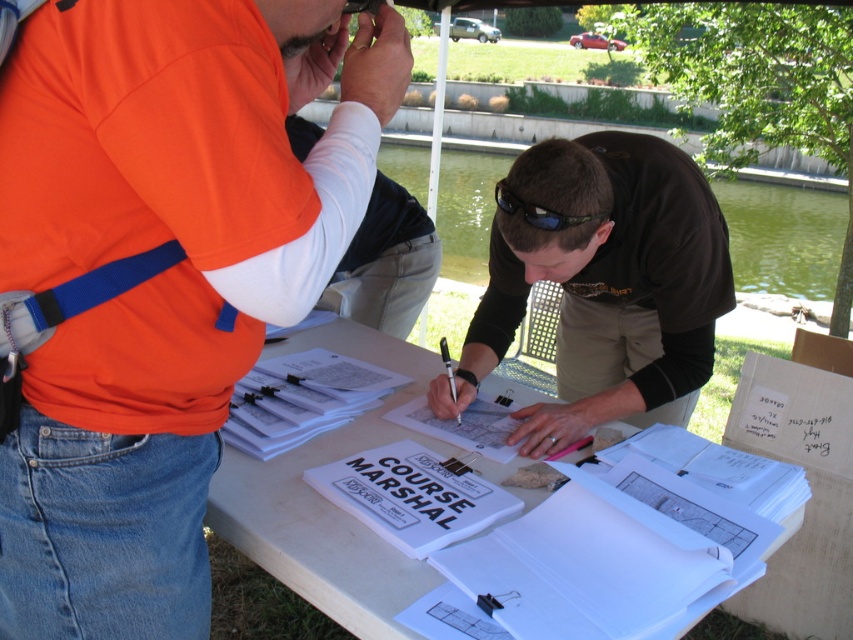
Question: Does orange fabric shirt at left come in front of black plastic sunglasses at center?

Choices:
 (A) no
 (B) yes

Answer: (B)

Question: Is orange fabric shirt at left bigger than white paper at center?

Choices:
 (A) yes
 (B) no

Answer: (B)

Question: Among these points, which one is farthest from the camera?

Choices:
 (A) (614, 241)
 (B) (221, 472)
 (C) (26, 513)
 (D) (608, 211)

Answer: (A)

Question: Based on their relative distances, which object is farther from the white paper at center?

Choices:
 (A) black matte shirt at center
 (B) black plastic sunglasses at center

Answer: (B)

Question: Among these objects, which one is farthest from the camera?

Choices:
 (A) black matte shirt at center
 (B) orange fabric shirt at left
 (C) white paper at center

Answer: (A)

Question: Is black matte shirt at center to the left of black plastic sunglasses at center from the viewer's perspective?

Choices:
 (A) no
 (B) yes

Answer: (A)